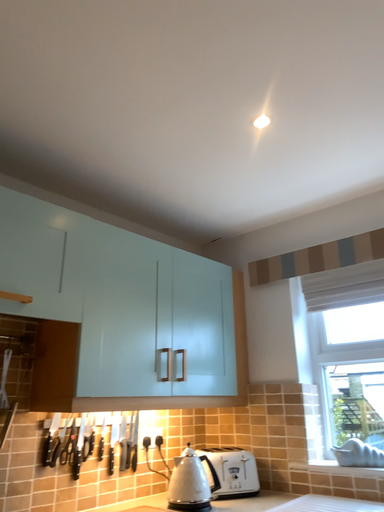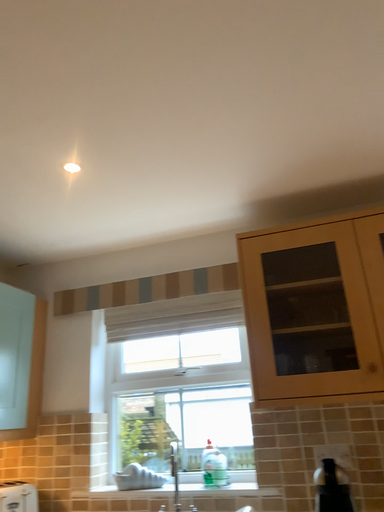
Question: Which way did the camera rotate in the video?

Choices:
 (A) rotated left
 (B) rotated right

Answer: (B)